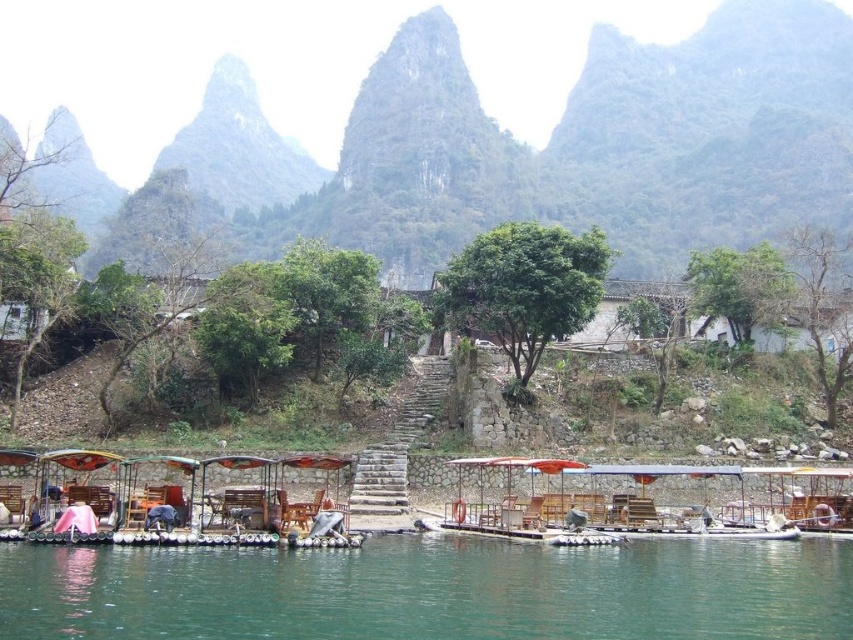
Question: Among these objects, which one is nearest to the camera?

Choices:
 (A) wooden boat at lower left
 (B) green textured mountain at upper center

Answer: (A)

Question: Is green water at lower center above wooden boat at lower left?

Choices:
 (A) no
 (B) yes

Answer: (A)

Question: Can you confirm if green textured mountain at upper center is positioned to the left of green water at lower center?

Choices:
 (A) yes
 (B) no

Answer: (A)

Question: Among these objects, which one is farthest from the camera?

Choices:
 (A) wooden boat at lower left
 (B) green textured mountain at upper center
 (C) green water at lower center
 (D) wooden boat at center

Answer: (B)

Question: Is green textured mountain at upper center above wooden boat at lower left?

Choices:
 (A) no
 (B) yes

Answer: (B)

Question: Which point is closer to the camera taking this photo?

Choices:
 (A) (212, 480)
 (B) (703, 577)

Answer: (B)